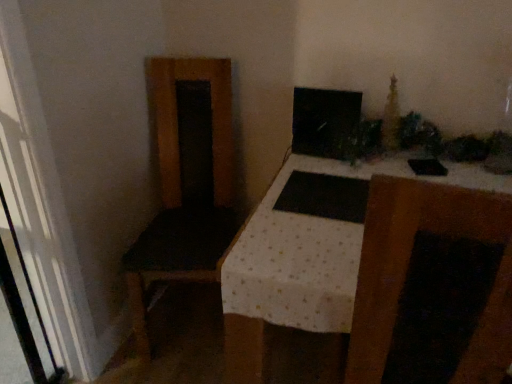
The image size is (512, 384). I want to click on vacant space in matte black monitor at upper center (from a real-world perspective), so click(x=323, y=151).